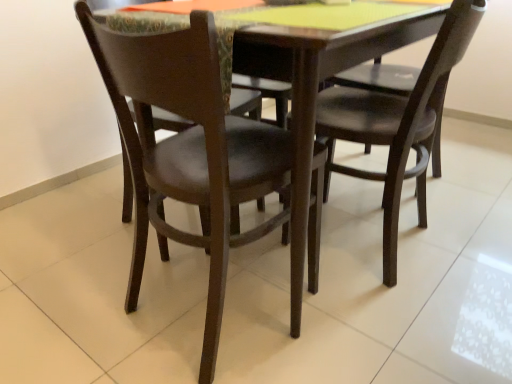
I want to click on free region on the left part of matte dark brown chair at center, marked as the 1th chair in a left-to-right arrangement, so click(84, 306).